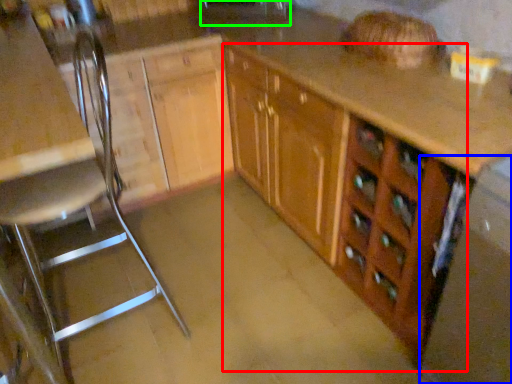
Question: Based on their relative distances, which object is farther from cabinetry (highlighted by a red box)? Choose from appliance (highlighted by a blue box) and sink (highlighted by a green box).

Choices:
 (A) appliance
 (B) sink

Answer: (B)